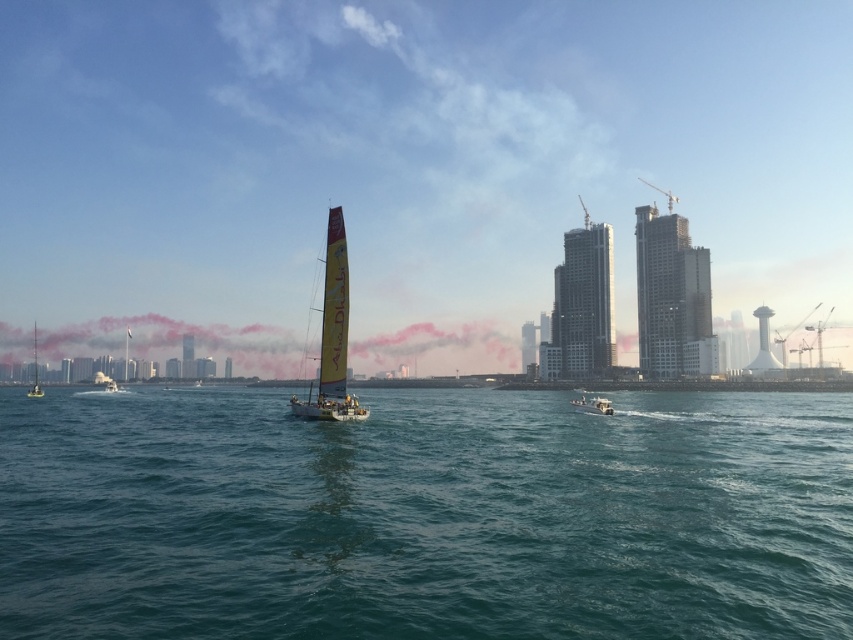
Who is more forward, (701, 596) or (329, 240)?

Point (701, 596) is in front.

Does teal water at center appear under yellow fabric sailboat at center?

Yes.

What are the coordinates of `teal water at center` in the screenshot? It's located at (425, 516).

Measure the distance between teal water at center and pink smoke at center.

They are 217.77 feet apart.

Locate an element on the screen. teal water at center is located at coordinates pos(425,516).

Identify the location of teal water at center. (425, 516).

Can you confirm if pink smoke at center is thinner than metallic silver boat at center?

No.

Is point (39, 342) closer to viewer compared to point (605, 406)?

That is False.

What are the coordinates of `pink smoke at center` in the screenshot? It's located at (178, 340).